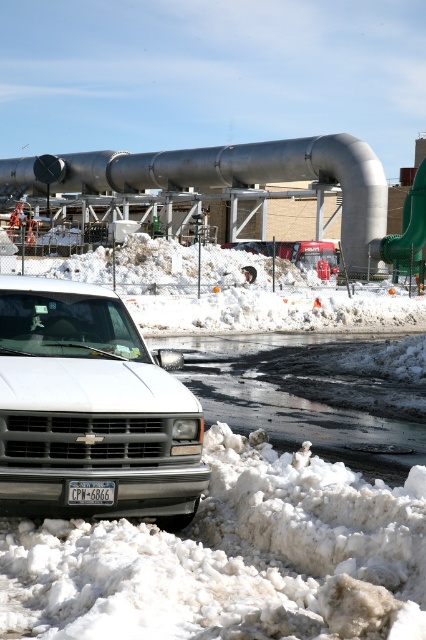
Question: Is brushed metal pipe at center bigger than metallic red truck at center?

Choices:
 (A) yes
 (B) no

Answer: (A)

Question: Which point appears closest to the camera in this image?

Choices:
 (A) (180, 525)
 (B) (80, 492)
 (C) (224, 436)
 (D) (310, 262)

Answer: (B)

Question: Can you confirm if white fluffy snow at lower center is positioned above metallic red truck at center?

Choices:
 (A) yes
 (B) no

Answer: (B)

Question: Is white matte truck at lower left bigger than brushed metal pipe at center?

Choices:
 (A) no
 (B) yes

Answer: (A)

Question: Estimate the real-world distances between objects in this image. Which object is closer to the matte black license plate at center?

Choices:
 (A) brushed metal pipe at center
 (B) white fluffy snow at lower center
 (C) white matte truck at lower left
 (D) metallic red truck at center

Answer: (C)

Question: Among these points, which one is nearest to the camera?

Choices:
 (A) (83, 483)
 (B) (8, 436)
 (C) (31, 598)
 (D) (20, 164)

Answer: (C)